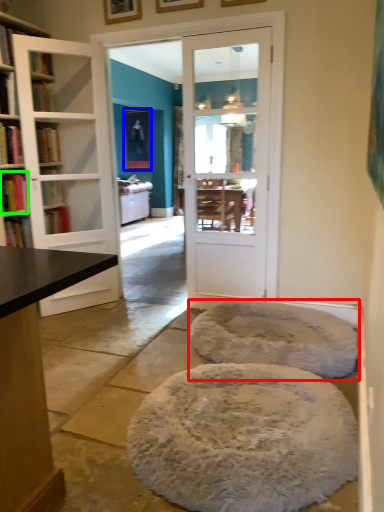
Question: Which is farther away from cat bed (highlighted by a red box)? picture frame (highlighted by a blue box) or book (highlighted by a green box)?

Choices:
 (A) picture frame
 (B) book

Answer: (A)